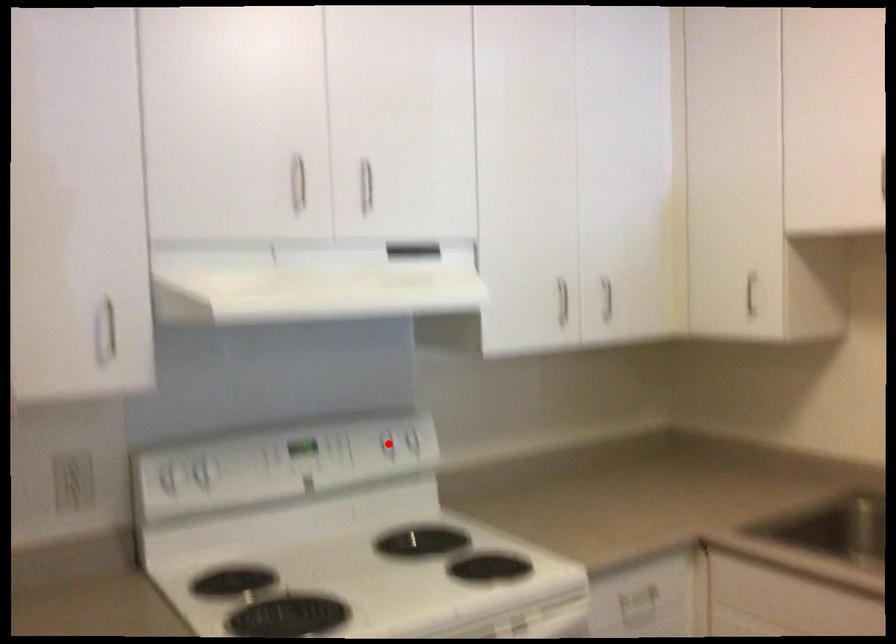
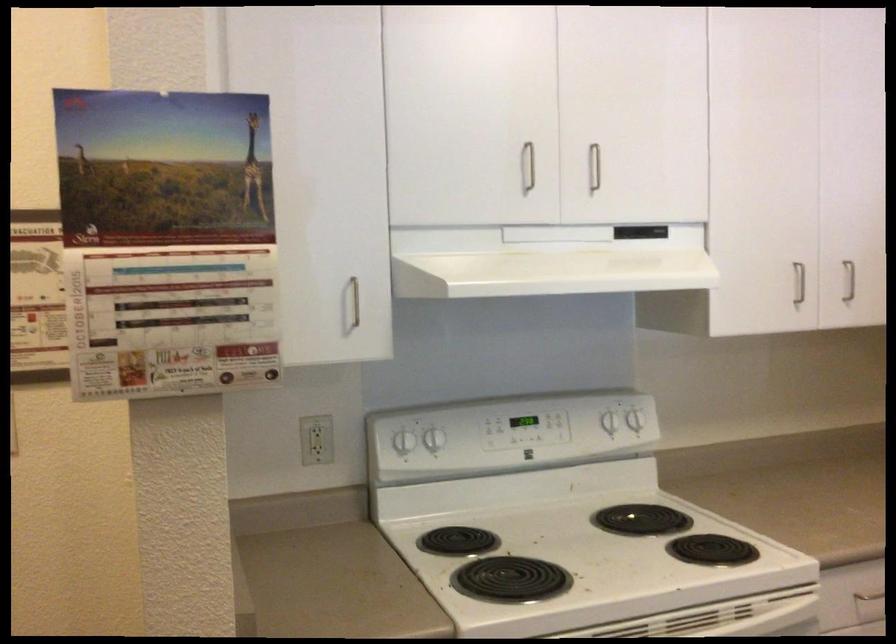
Question: I am providing you with two images of the same scene from different viewpoints. A red point is marked on the first image. At the location where the point appears in image 1, is it still visible in image 2?

Choices:
 (A) Yes
 (B) No

Answer: (A)